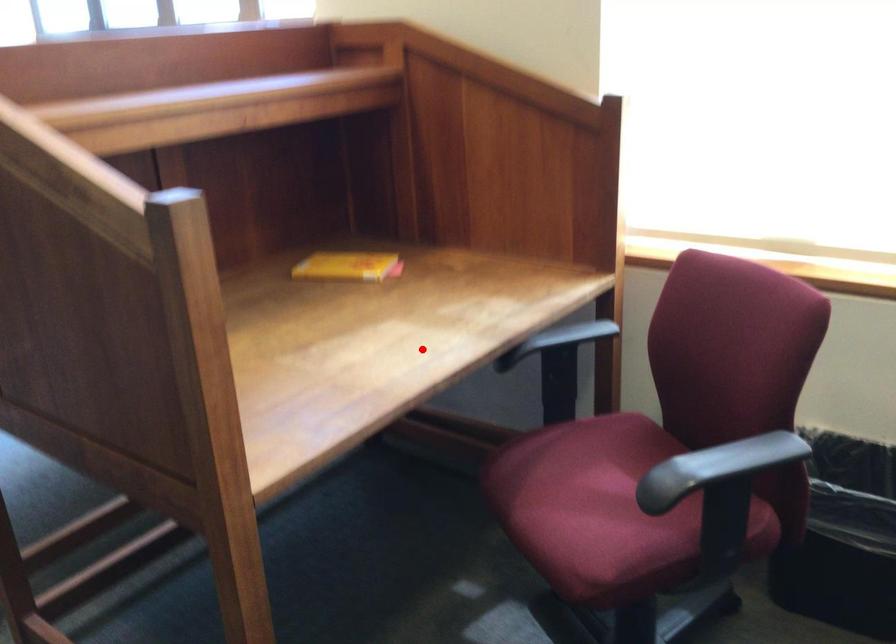
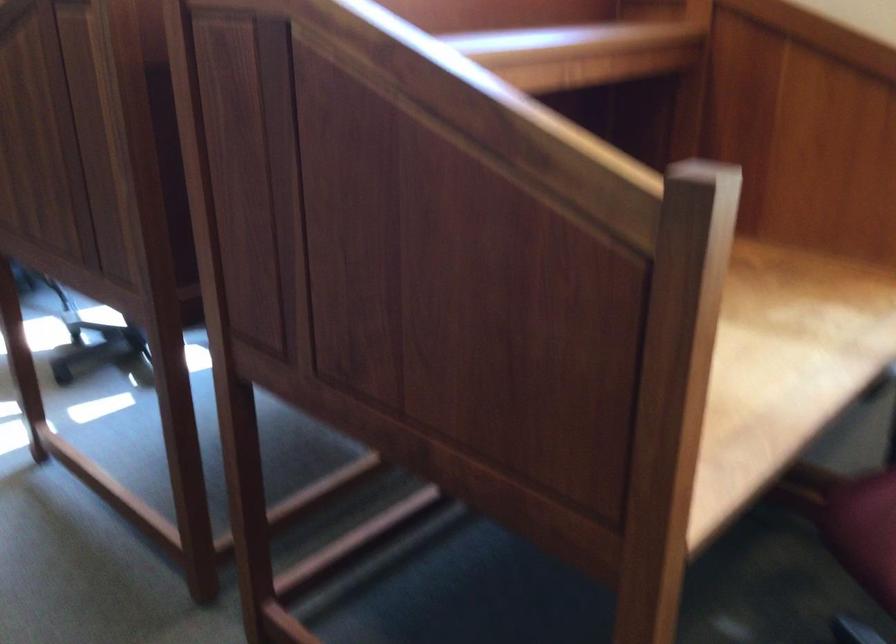
Where in the second image is the point corresponding to the highlighted location from the first image?

(778, 360)